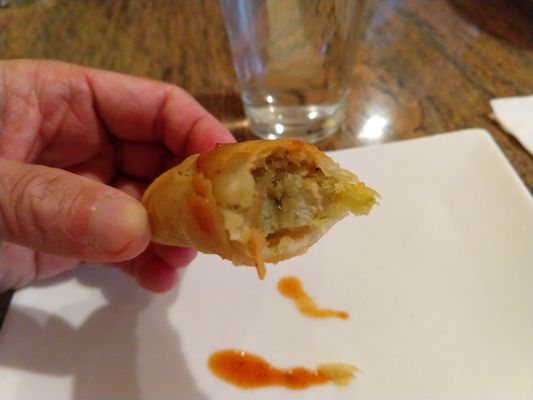
In order to click on plate in this screenshot , I will do `click(478, 164)`.